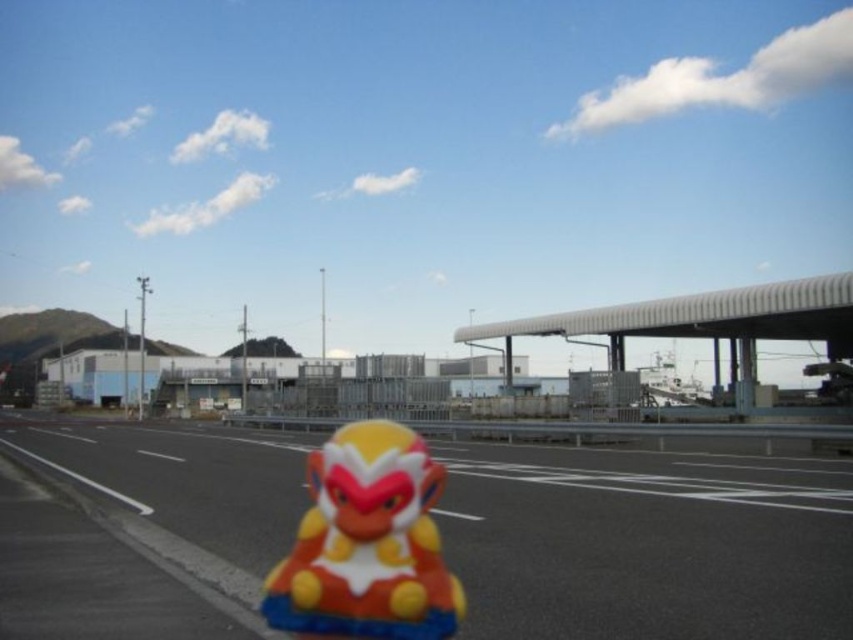
What do you see at coordinates (647, 544) in the screenshot? This screenshot has height=640, width=853. I see `smooth asphalt highway at center` at bounding box center [647, 544].

Between smooth asphalt highway at center and glossy plastic monkey at center, which one appears on the right side from the viewer's perspective?

glossy plastic monkey at center

Is point (77, 442) less distant than point (260, 598)?

No, (77, 442) is behind (260, 598).

Identify the location of smooth asphalt highway at center. Image resolution: width=853 pixels, height=640 pixels. (647, 544).